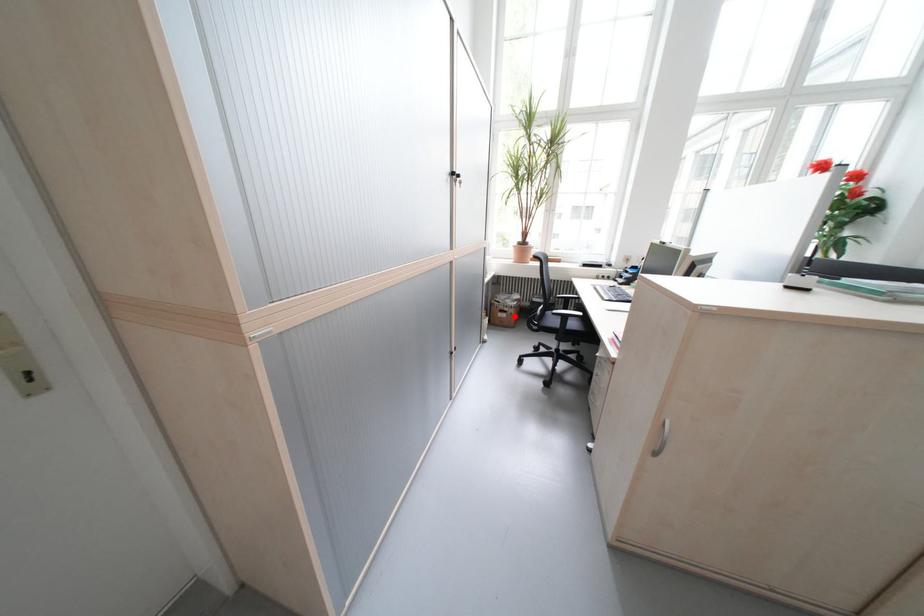
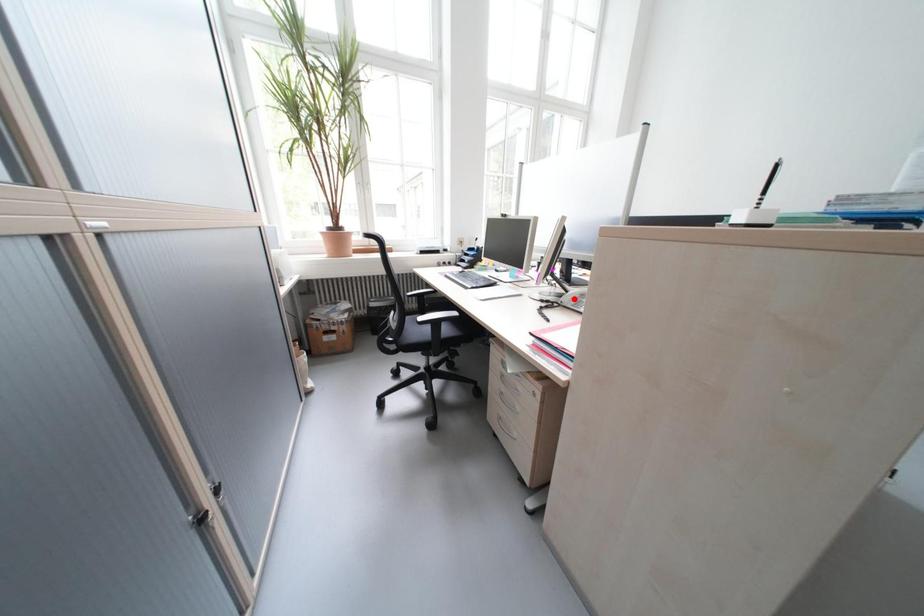
I am providing you with two images of the same scene from different viewpoints. A red point is marked on the first image and another point is marked on the second image. Do the highlighted points in image1 and image2 indicate the same real-world spot?

No